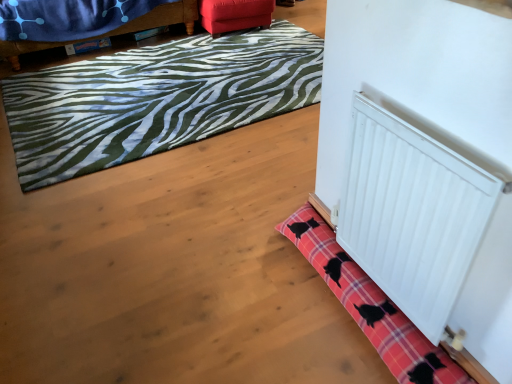
Question: Considering their positions, is white smooth radiator at lower right located in front of or behind green zebra-patterned rug at upper left, the 1th bath mat from the top?

Choices:
 (A) behind
 (B) front

Answer: (B)

Question: Is white smooth radiator at lower right taller or shorter than green zebra-patterned rug at upper left, the 1th bath mat from the top?

Choices:
 (A) short
 (B) tall

Answer: (B)

Question: Estimate the real-world distances between objects in this image. Which object is farther from the velvet blue blanket at upper left, positioned as the 1th furniture in left-to-right order?

Choices:
 (A) pink plaid bath mat at lower right, acting as the first bath mat starting from the bottom
 (B) velvet red ottoman at upper center, the first furniture from the right
 (C) white smooth radiator at lower right
 (D) green zebra-patterned rug at upper left, acting as the 2th bath mat starting from the front

Answer: (C)

Question: Which object is positioned closest to the white smooth radiator at lower right?

Choices:
 (A) velvet blue blanket at upper left, positioned as the 1th furniture in left-to-right order
 (B) green zebra-patterned rug at upper left, the 2th bath mat in the bottom-to-top sequence
 (C) velvet red ottoman at upper center, the first furniture from the right
 (D) pink plaid bath mat at lower right, the 2th bath mat in the back-to-front sequence

Answer: (D)